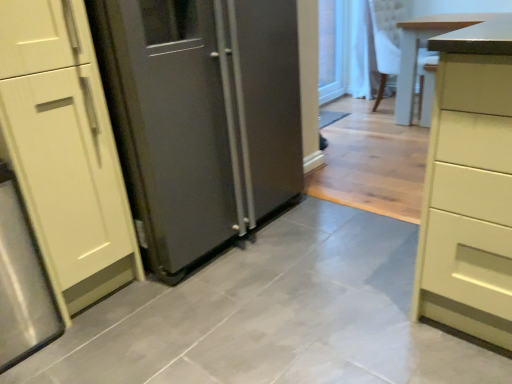
Question: Does satin silver refrigerator at center have a greater width compared to transparent glass door at upper right?

Choices:
 (A) no
 (B) yes

Answer: (B)

Question: Can you confirm if satin silver refrigerator at center is shorter than transparent glass door at upper right?

Choices:
 (A) no
 (B) yes

Answer: (A)

Question: Is the position of satin silver refrigerator at center more distant than that of transparent glass door at upper right?

Choices:
 (A) yes
 (B) no

Answer: (B)

Question: Can you confirm if satin silver refrigerator at center is positioned to the right of transparent glass door at upper right?

Choices:
 (A) no
 (B) yes

Answer: (A)

Question: Is satin silver refrigerator at center closer to camera compared to transparent glass door at upper right?

Choices:
 (A) yes
 (B) no

Answer: (A)

Question: Considering the relative sizes of satin silver refrigerator at center and transparent glass door at upper right in the image provided, is satin silver refrigerator at center bigger than transparent glass door at upper right?

Choices:
 (A) yes
 (B) no

Answer: (A)

Question: From a real-world perspective, is light wood table at right on satin silver refrigerator at center?

Choices:
 (A) no
 (B) yes

Answer: (A)

Question: Does light wood table at right appear on the right side of satin silver refrigerator at center?

Choices:
 (A) yes
 (B) no

Answer: (A)

Question: Can you confirm if light wood table at right is bigger than satin silver refrigerator at center?

Choices:
 (A) no
 (B) yes

Answer: (A)

Question: Is light wood table at right wider than satin silver refrigerator at center?

Choices:
 (A) no
 (B) yes

Answer: (B)

Question: Is light wood table at right to the left of satin silver refrigerator at center from the viewer's perspective?

Choices:
 (A) no
 (B) yes

Answer: (A)

Question: Does light wood table at right touch satin silver refrigerator at center?

Choices:
 (A) yes
 (B) no

Answer: (B)

Question: Is light wood table at right facing away from transparent glass door at upper right?

Choices:
 (A) no
 (B) yes

Answer: (A)